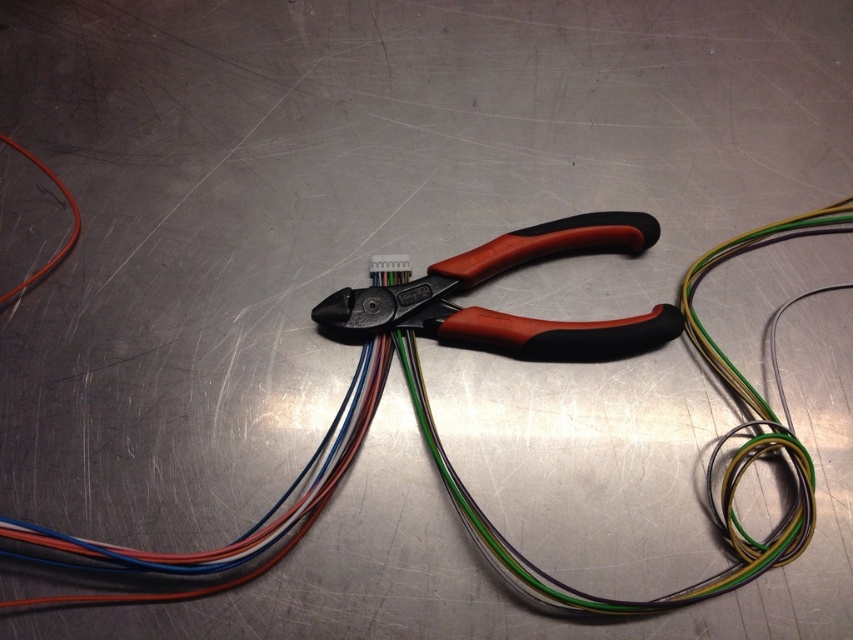
Is orange cable at left above matte black pliers at center?

Correct, orange cable at left is located above matte black pliers at center.

This screenshot has width=853, height=640. Find the location of `orange cable at left`. orange cable at left is located at coordinates (65, 241).

This screenshot has width=853, height=640. In order to click on orange cable at left in this screenshot , I will do `click(65, 241)`.

The image size is (853, 640). Find the location of `orange cable at left`. orange cable at left is located at coordinates (65, 241).

Is orange rubberized pliers at center shorter than orange cable at left?

Correct, orange rubberized pliers at center is not as tall as orange cable at left.

Who is more forward, (x=630, y=317) or (x=68, y=236)?

Point (x=68, y=236)

At what (x,y) coordinates should I click in order to perform the action: click on orange rubberized pliers at center. Please return your answer as a coordinate pair (x, y). The width and height of the screenshot is (853, 640). Looking at the image, I should click on (508, 314).

Between point (459, 268) and point (378, 257), which one is positioned behind?

Positioned behind is point (378, 257).

Is orange rubberized pliers at center thinner than matte black pliers at center?

In fact, orange rubberized pliers at center might be wider than matte black pliers at center.

Between point (552, 256) and point (404, 268), which one is positioned behind?

Positioned behind is point (552, 256).

Identify the location of orange rubberized pliers at center. (508, 314).